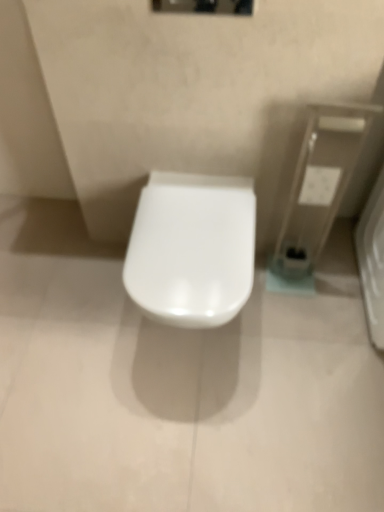
Where is `white glossy toilet at center`? white glossy toilet at center is located at coordinates (192, 248).

Describe the element at coordinates (192, 248) in the screenshot. This screenshot has width=384, height=512. I see `white glossy toilet at center` at that location.

In order to click on white glossy toilet at center in this screenshot , I will do `click(192, 248)`.